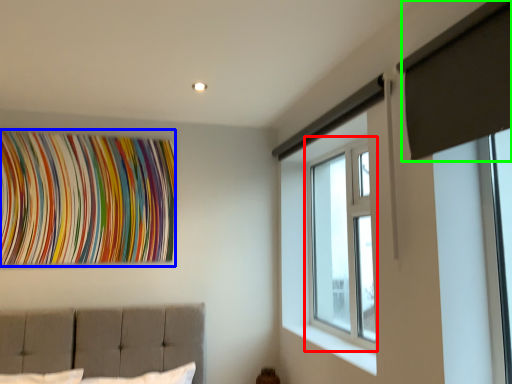
Question: Considering the real-world distances, which object is farthest from window (highlighted by a red box)? tapestry (highlighted by a blue box) or curtain (highlighted by a green box)?

Choices:
 (A) tapestry
 (B) curtain

Answer: (A)